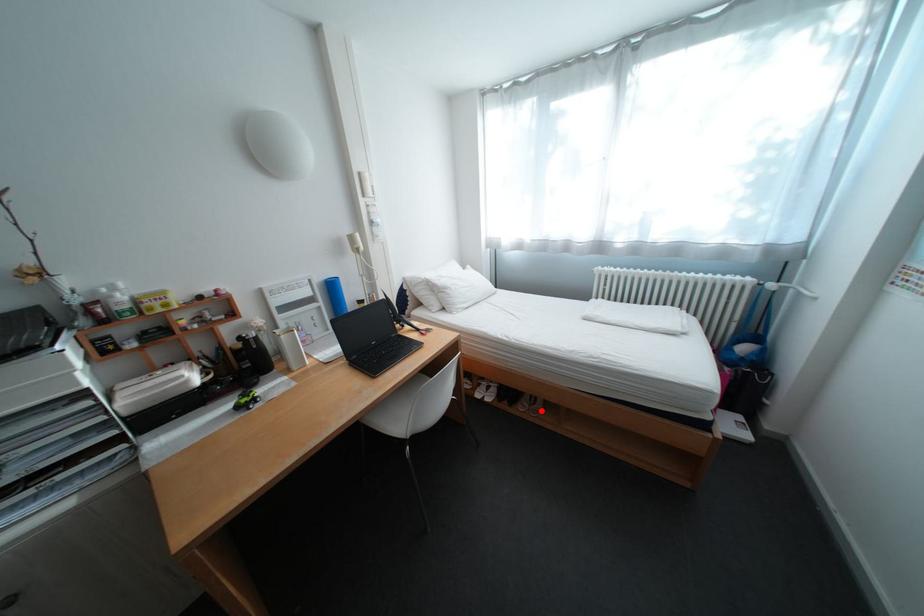
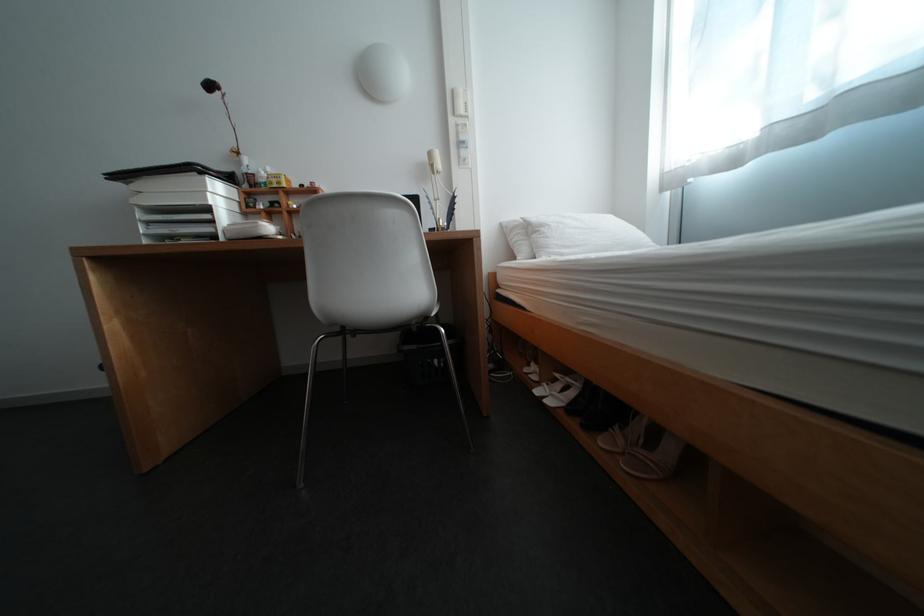
Question: I am providing you with two images of the same scene from different viewpoints. A red point is shown in image1. For the corresponding object point in image2, is it positioned nearer or farther from the camera?

Choices:
 (A) Nearer
 (B) Farther

Answer: (A)